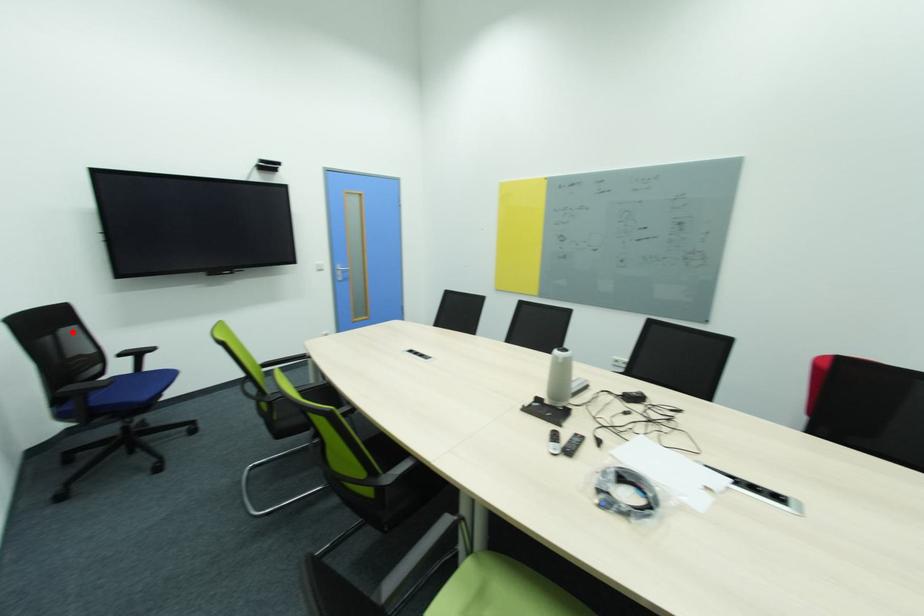
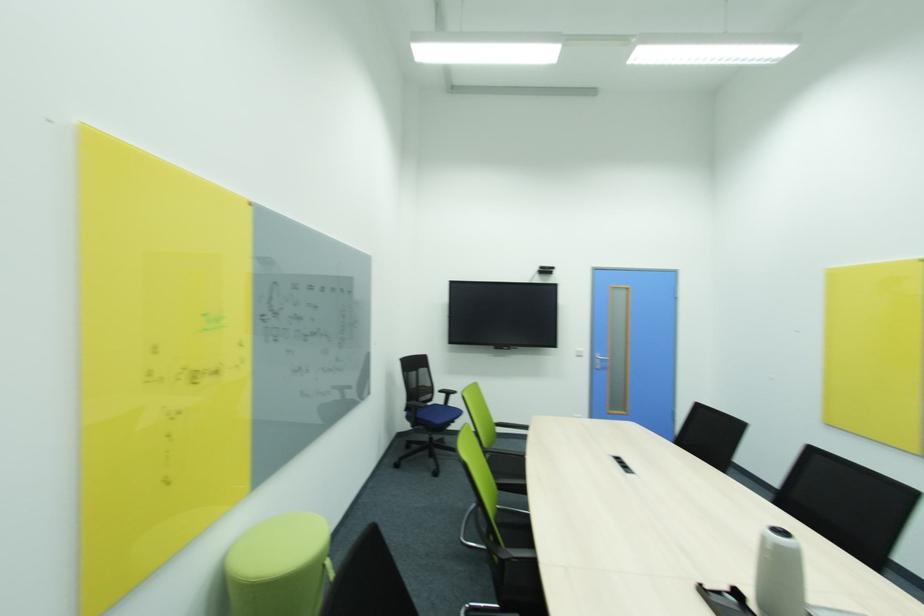
Locate, in the second image, the point that corresponds to the highlighted location in the first image.

(428, 371)